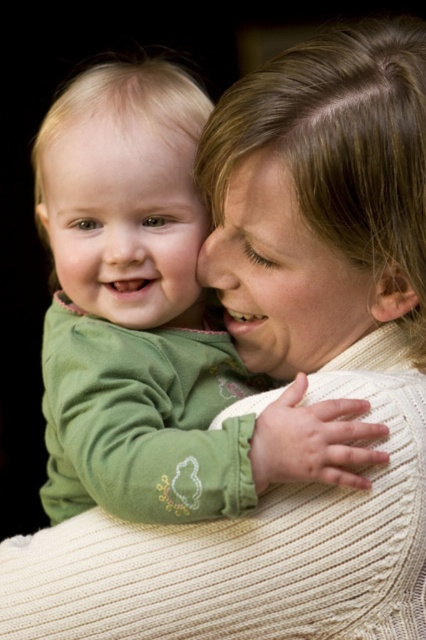
You are a photographer who wants to ensure both the green soft fabric baby at center and the smooth green baby at center are clearly visible in the photo. Given their size difference, which baby should you focus on to ensure both are in focus?

The green soft fabric baby at center is larger in size than smooth green baby at center, so focusing on the larger one will help ensure both are in focus as it occupies more space in the frame.

You are a photographer trying to capture the perfect shot of the smooth green baby at center. You need to position your camera at point A, which is at coordinates 0.344, 0.293. Can you confirm if the camera position aligns with the baby?

Yes, the smooth green baby at center is exactly at point (x=124, y=220), so positioning the camera there will align perfectly with the baby.